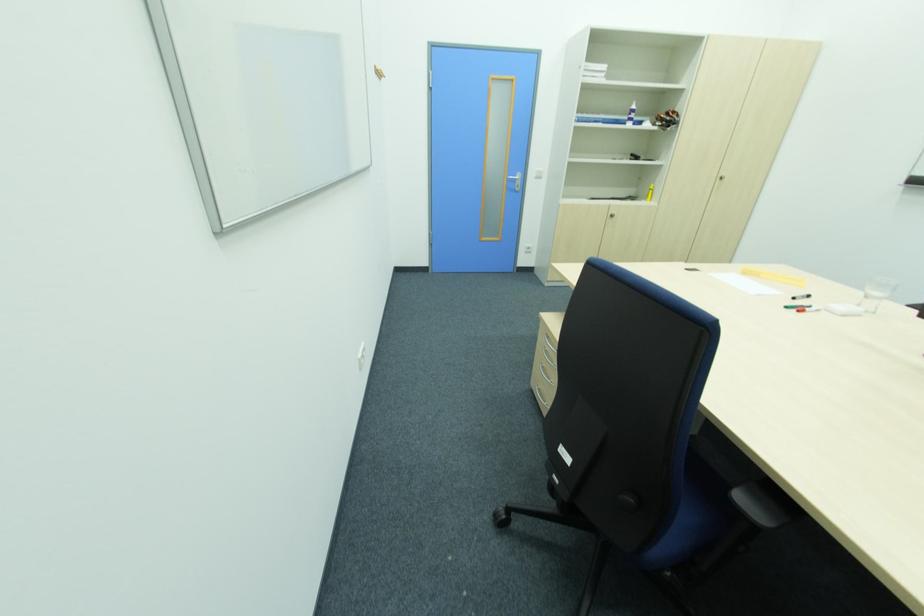
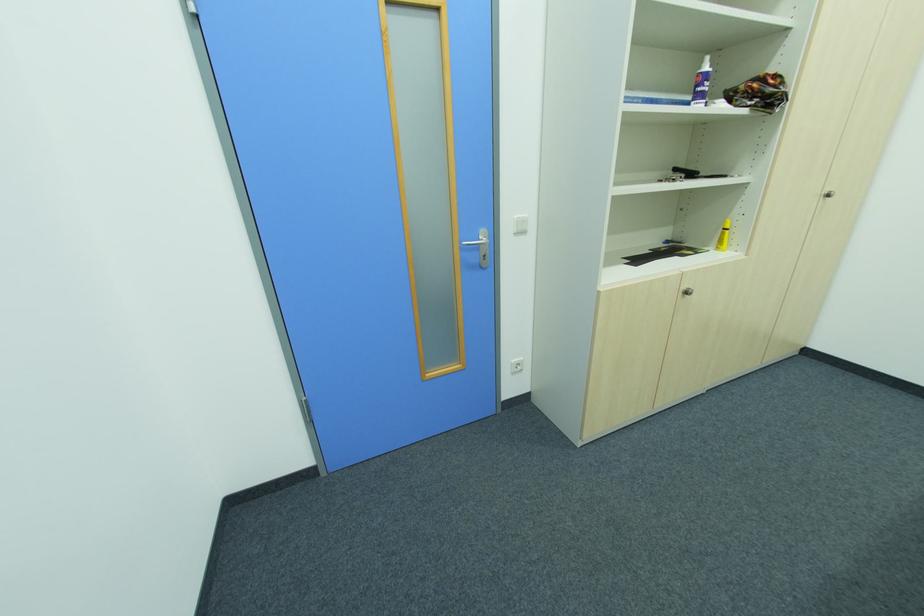
Locate, in the second image, the point that corresponds to point (721, 180) in the first image.

(822, 198)